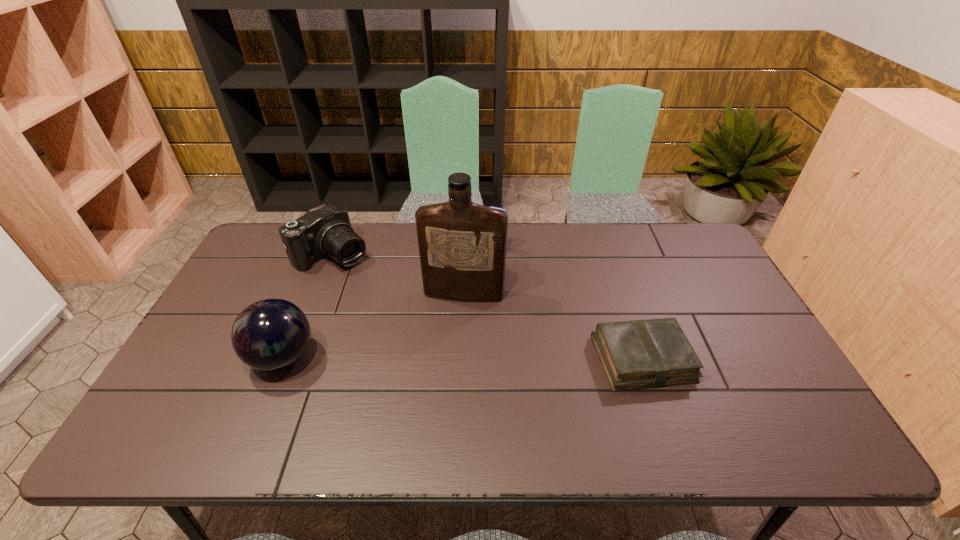
At what (x,y) coordinates should I click in order to perform the action: click on vacant point located 0.360m on the front-facing side of the cellular telephone. Please return your answer as a coordinate pair (x, y). The height and width of the screenshot is (540, 960). Looking at the image, I should click on point(454,332).

Find the location of a particular element. This screenshot has width=960, height=540. vacant area located 0.110m on the front-facing side of the cellular telephone is located at coordinates (482, 274).

This screenshot has height=540, width=960. Identify the location of vacant region located on the front-facing side of the cellular telephone. (452, 337).

Find the location of `vacant space located on the label side of the tallest object`. vacant space located on the label side of the tallest object is located at coordinates (441, 400).

Find the location of a particular element. This screenshot has height=540, width=960. free space located 0.110m on the label side of the tallest object is located at coordinates (454, 330).

At what (x,y) coordinates should I click in order to perform the action: click on vacant space located 0.090m on the label side of the tallest object. Please return your answer as a coordinate pair (x, y). Looking at the image, I should click on (455, 325).

Where is `blank space located on the lens of the camera`? This screenshot has height=540, width=960. blank space located on the lens of the camera is located at coordinates (410, 316).

At what (x,y) coordinates should I click in order to perform the action: click on vacant space located 0.090m on the lens of the camera. Please return your answer as a coordinate pair (x, y). Image resolution: width=960 pixels, height=540 pixels. Looking at the image, I should click on (370, 282).

What are the coordinates of `vacant space located 0.150m on the lens of the camera` in the screenshot? It's located at (381, 292).

The height and width of the screenshot is (540, 960). In order to click on cellular telephone at the far edge in this screenshot , I will do `click(499, 208)`.